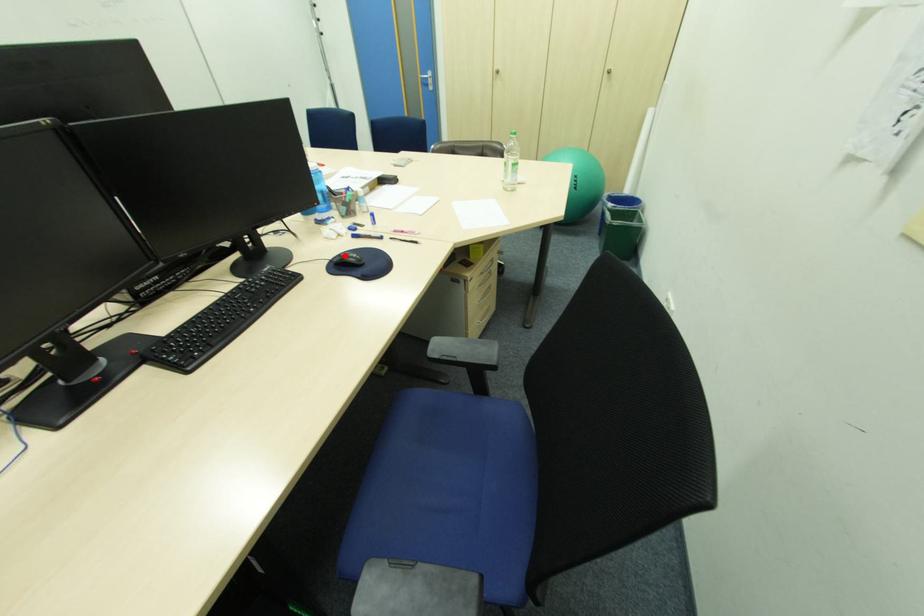
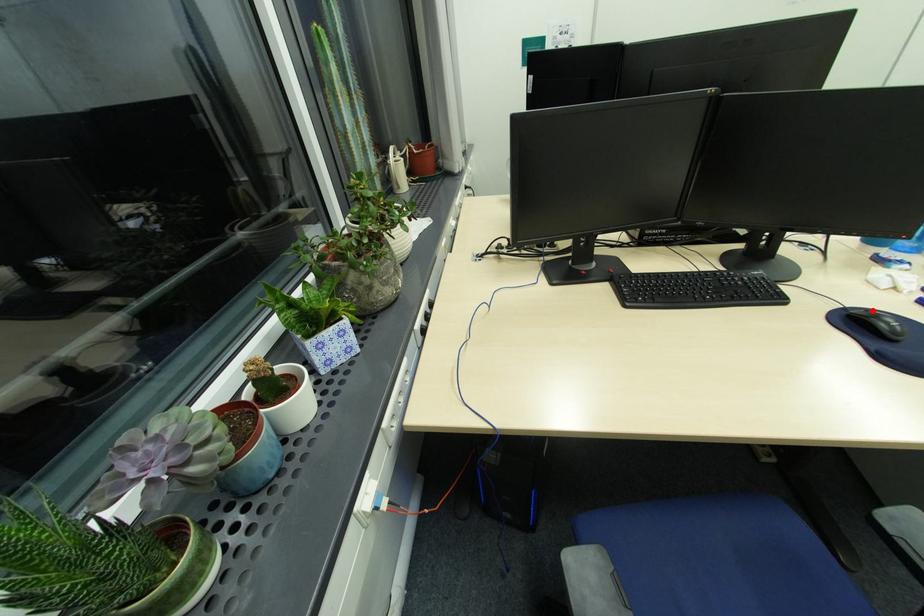
I am providing you with two images of the same scene from different viewpoints. A red point is marked on the first image and another point is marked on the second image. Are the points marked in image1 and image2 representing the same 3D position?

Yes